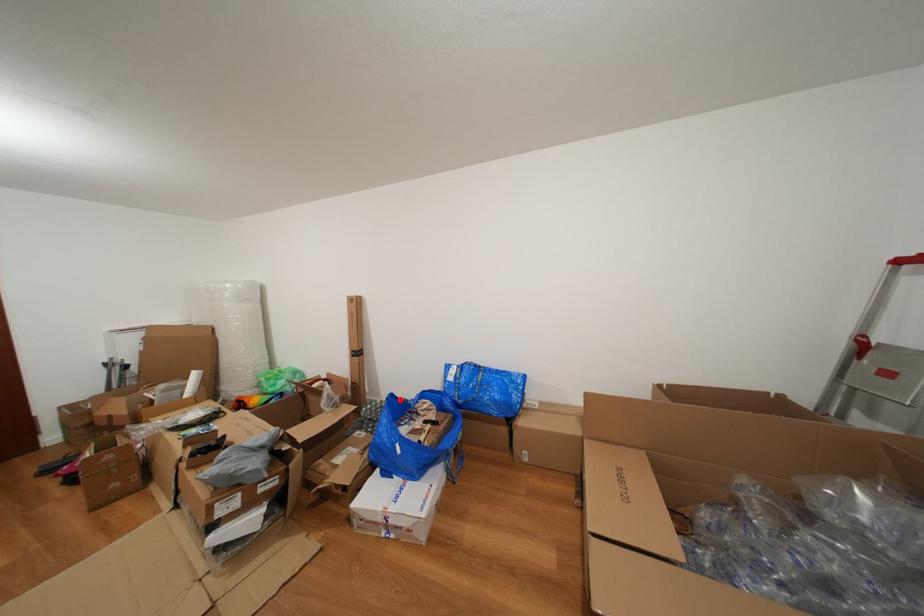
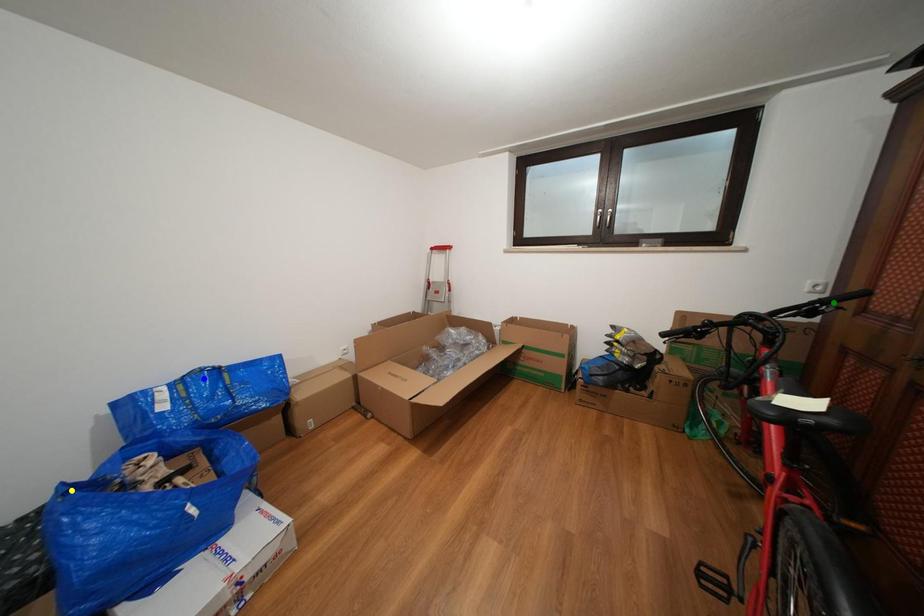
Question: I am providing you with two images of the same scene from different viewpoints. A red point is marked on the first image. You are given multiple points on the second image. In image 2, which mark is for the same physical point as the one in image 1?

Choices:
 (A) yellow point
 (B) blue point
 (C) green point

Answer: (A)